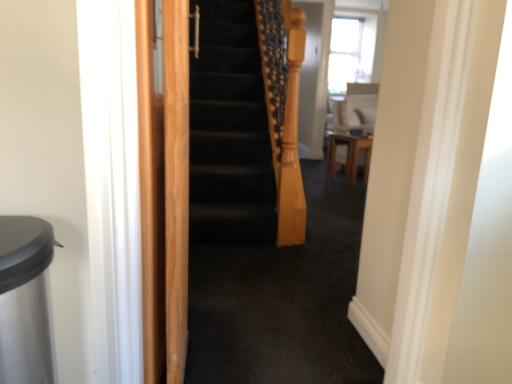
Question: Considering the relative sizes of wooden table at center and white glossy chair at upper right in the image provided, is wooden table at center shorter than white glossy chair at upper right?

Choices:
 (A) no
 (B) yes

Answer: (B)

Question: Considering the relative sizes of wooden table at center and white glossy chair at upper right in the image provided, is wooden table at center taller than white glossy chair at upper right?

Choices:
 (A) yes
 (B) no

Answer: (B)

Question: Can you confirm if wooden table at center is wider than white glossy chair at upper right?

Choices:
 (A) no
 (B) yes

Answer: (A)

Question: From a real-world perspective, does wooden table at center stand above white glossy chair at upper right?

Choices:
 (A) no
 (B) yes

Answer: (A)

Question: From the image's perspective, does wooden table at center appear lower than white glossy chair at upper right?

Choices:
 (A) yes
 (B) no

Answer: (A)

Question: Does point (148, 271) appear closer or farther from the camera than point (336, 105)?

Choices:
 (A) farther
 (B) closer

Answer: (B)

Question: From a real-world perspective, is light brown wood screen door at left positioned above or below white glossy chair at upper right?

Choices:
 (A) below
 (B) above

Answer: (A)

Question: In terms of size, does light brown wood screen door at left appear bigger or smaller than white glossy chair at upper right?

Choices:
 (A) big
 (B) small

Answer: (B)

Question: Considering the positions of light brown wood screen door at left and white glossy chair at upper right in the image, is light brown wood screen door at left wider or thinner than white glossy chair at upper right?

Choices:
 (A) thin
 (B) wide

Answer: (A)

Question: Is wooden table at center to the left or to the right of light brown wood screen door at left in the image?

Choices:
 (A) right
 (B) left

Answer: (A)

Question: From a real-world perspective, is wooden table at center physically located above or below light brown wood screen door at left?

Choices:
 (A) below
 (B) above

Answer: (A)

Question: Is point (335, 142) positioned closer to the camera than point (159, 18)?

Choices:
 (A) farther
 (B) closer

Answer: (A)

Question: In terms of height, does wooden table at center look taller or shorter compared to light brown wood screen door at left?

Choices:
 (A) tall
 (B) short

Answer: (B)

Question: Considering the positions of light brown wood screen door at left and wooden table at center in the image, is light brown wood screen door at left bigger or smaller than wooden table at center?

Choices:
 (A) small
 (B) big

Answer: (A)

Question: In the image, is light brown wood screen door at left positioned in front of or behind wooden table at center?

Choices:
 (A) front
 (B) behind

Answer: (A)